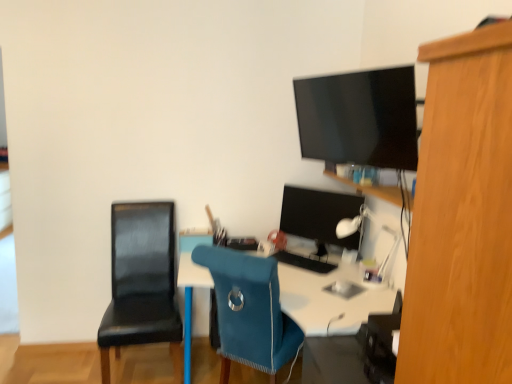
The image size is (512, 384). In order to click on free space in front of black matte keyboard at center in this screenshot , I will do `click(315, 283)`.